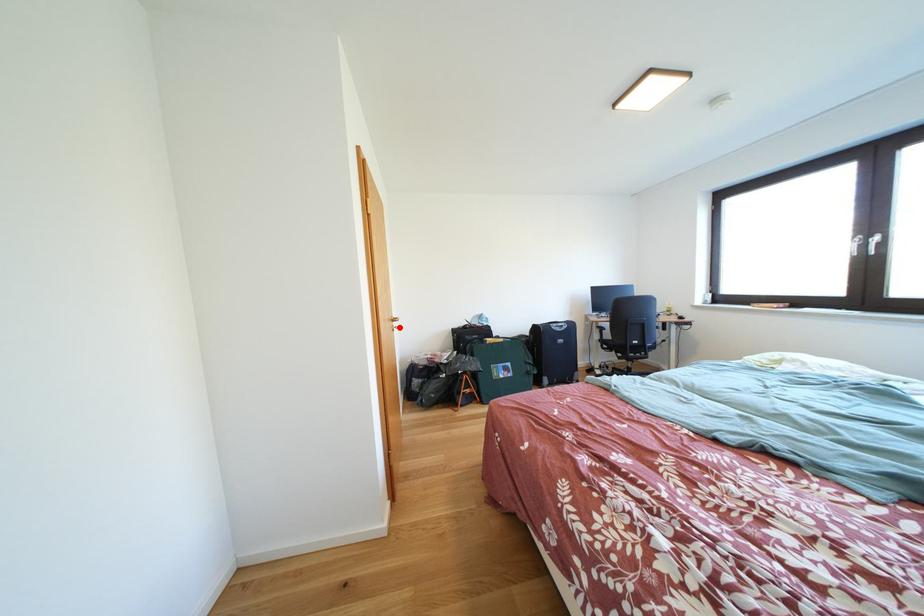
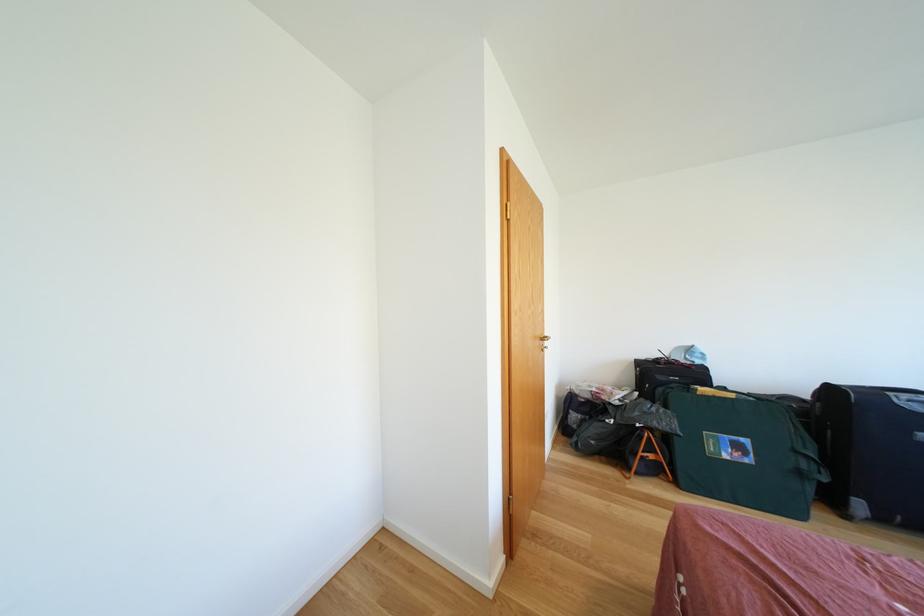
Question: I am providing you with two images of the same scene from different viewpoints. A red point is marked on the first image. At the location where the point appears in image 1, is it still visible in image 2?

Choices:
 (A) Yes
 (B) No

Answer: (A)